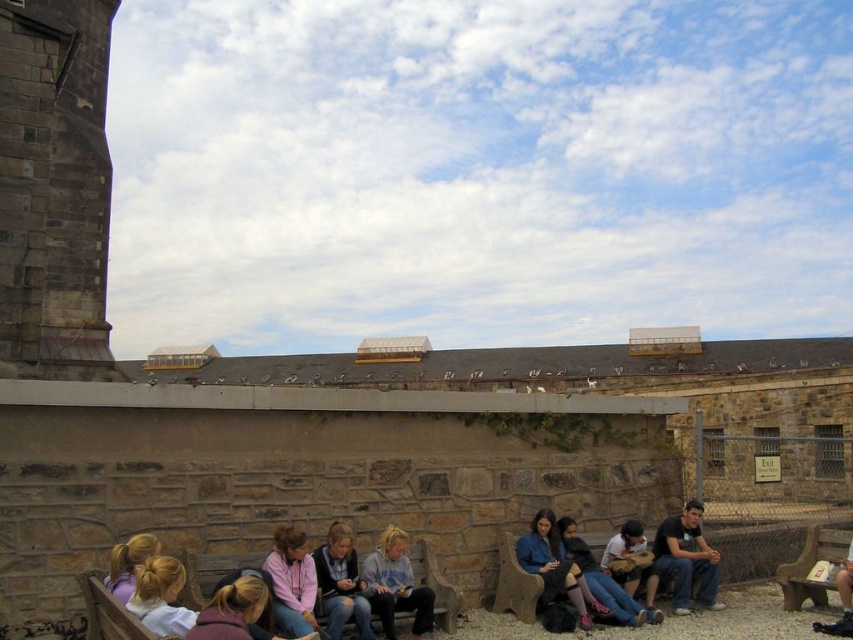
You are a photographer trying to capture a photo of the dark gray stone tower at left and the purple fabric hair at lower left. Since you want to emphasize the tower, which object should you focus on first?

The dark gray stone tower at left has a larger size compared to purple fabric hair at lower left, so you should focus on the dark gray stone tower at left first to emphasize its prominence.

You are a photographer trying to capture a photo of the dark gray stone tower at left and the purple fabric hair at lower left. Which object should you adjust your camera to focus on first if you want to include both in the frame?

Answer: The dark gray stone tower at left is positioned on the left side of purple fabric hair at lower left, so you should focus on the dark gray stone tower at left first to ensure both are in the frame.